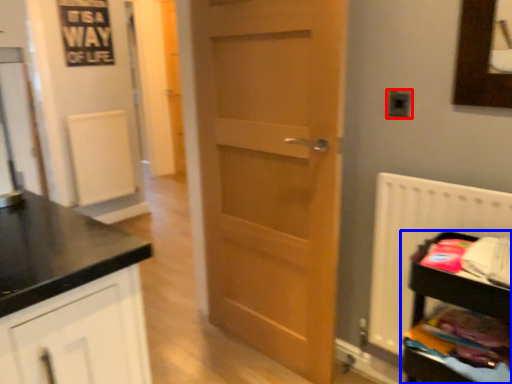
Question: Which point is further to the camera, electric outlet (highlighted by a red box) or shelf (highlighted by a blue box)?

Choices:
 (A) electric outlet
 (B) shelf

Answer: (A)